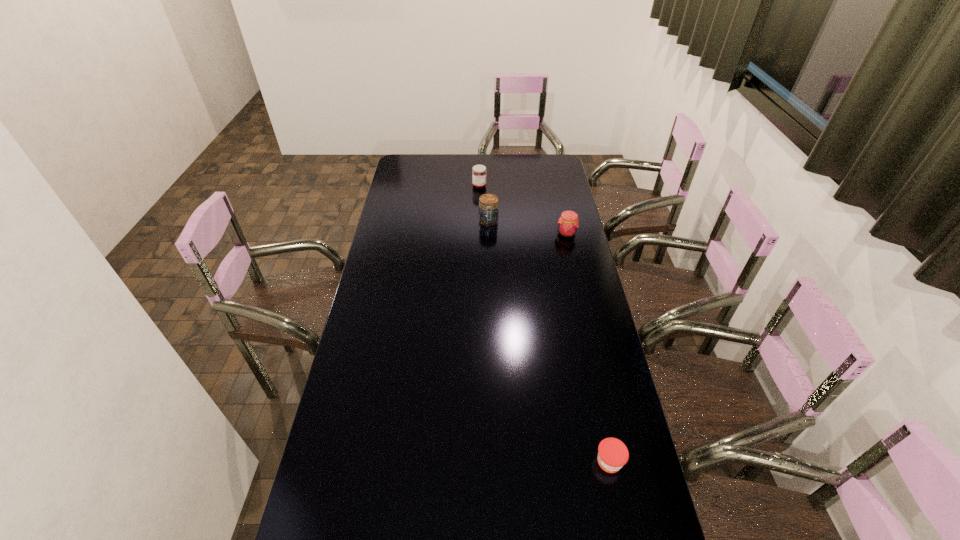
Locate an element on the screen. Image resolution: width=960 pixels, height=540 pixels. jar is located at coordinates (488, 213).

Locate an element on the screen. The width and height of the screenshot is (960, 540). the farthest jam is located at coordinates (479, 172).

Where is `the leftmost jam`? the leftmost jam is located at coordinates (479, 172).

Where is `the second farthest jam`? The image size is (960, 540). the second farthest jam is located at coordinates (568, 223).

Locate an element on the screen. The width and height of the screenshot is (960, 540). the shortest object is located at coordinates (612, 453).

Locate an element on the screen. This screenshot has height=540, width=960. the shortest jam is located at coordinates (612, 453).

The image size is (960, 540). Find the location of `vacant space located on the lid of the jar`. vacant space located on the lid of the jar is located at coordinates (490, 265).

At what (x,y) coordinates should I click in order to perform the action: click on vacant space situated on the front of the farthest jam. Please return your answer as a coordinate pair (x, y). The image size is (960, 540). Looking at the image, I should click on (479, 228).

Identify the location of vacant space located 0.400m on the back of the second nearest jam. The width and height of the screenshot is (960, 540). (554, 179).

Where is `free region located on the label side of the nearest jam`? The height and width of the screenshot is (540, 960). free region located on the label side of the nearest jam is located at coordinates (616, 496).